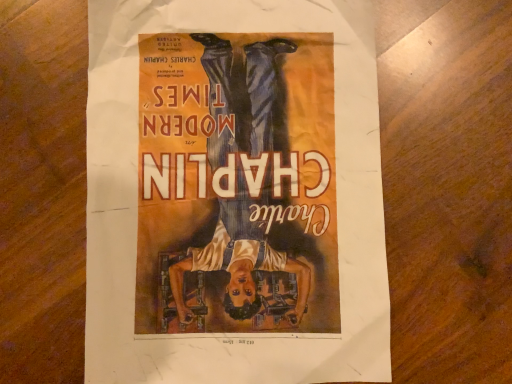
Describe the element at coordinates (234, 193) in the screenshot. Image resolution: width=512 pixels, height=384 pixels. I see `matte paper poster at center` at that location.

What is the approximate width of matte paper poster at center?

It is 12.16 inches.

In the scene shown: In order to face matte paper poster at center, should I rotate leftwards or rightwards?

To face it directly, rotate left by 2.921 degrees.

Find the location of `matte paper poster at center`. matte paper poster at center is located at coordinates (234, 193).

Where is `matte paper poster at center`? This screenshot has height=384, width=512. matte paper poster at center is located at coordinates (234, 193).